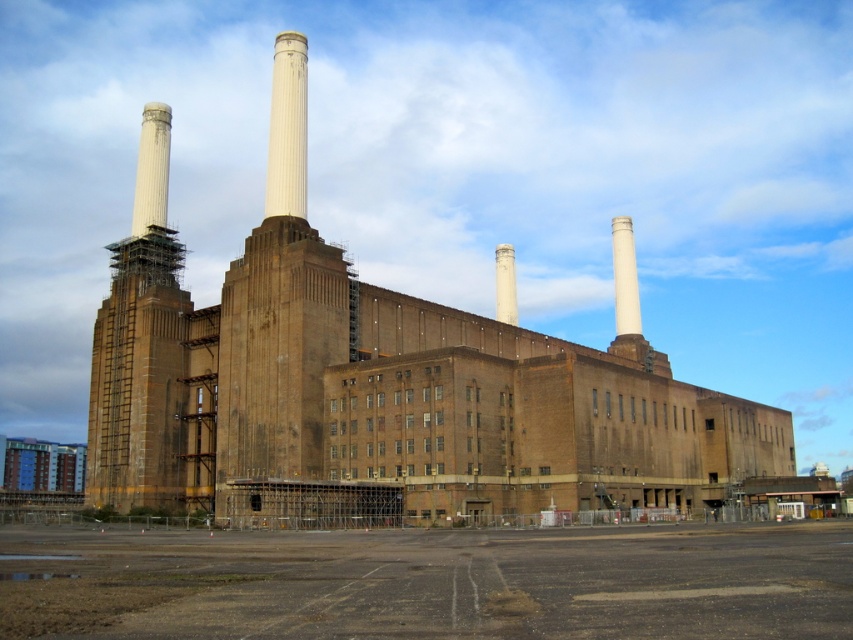
From the picture: Measure the distance between brown brick building at center and camera.

brown brick building at center is 198.03 feet from camera.

Find the location of `brown brick building at center`. brown brick building at center is located at coordinates (389, 385).

Who is more forward, (321, 385) or (511, 321)?

Point (321, 385) is in front.

Is point (292, 316) farther from camera compared to point (515, 308)?

That is False.

Is point (224, 362) more distant than point (496, 298)?

That is False.

Where is `smooth white tower at center`? smooth white tower at center is located at coordinates (279, 308).

How far apart are brown brick building at center and brown brick tower at left?

brown brick building at center is 66.48 feet from brown brick tower at left.

In order to click on brown brick building at center in this screenshot , I will do [x=389, y=385].

What do you see at coordinates (389, 385) in the screenshot?
I see `brown brick building at center` at bounding box center [389, 385].

Find the location of a particular element. This screenshot has height=640, width=853. brown brick building at center is located at coordinates (389, 385).